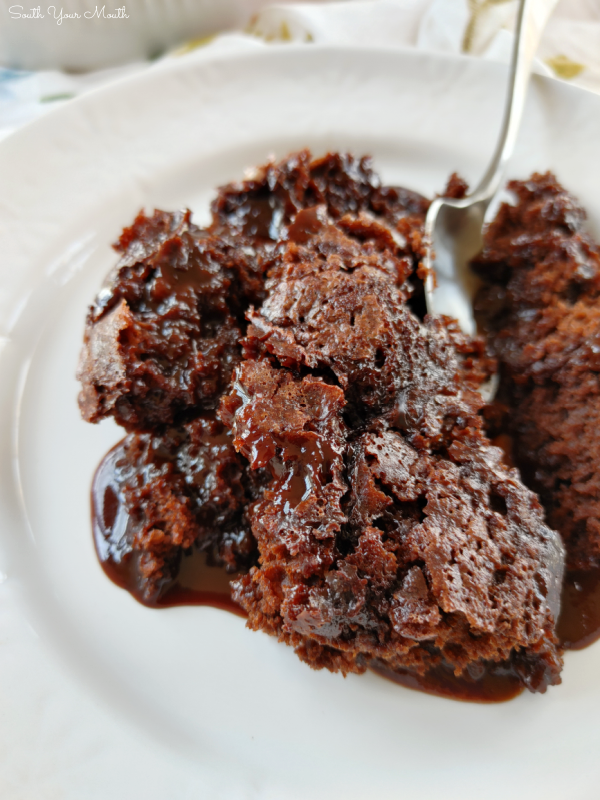
This screenshot has width=600, height=800. I want to click on spoon, so click(456, 282).